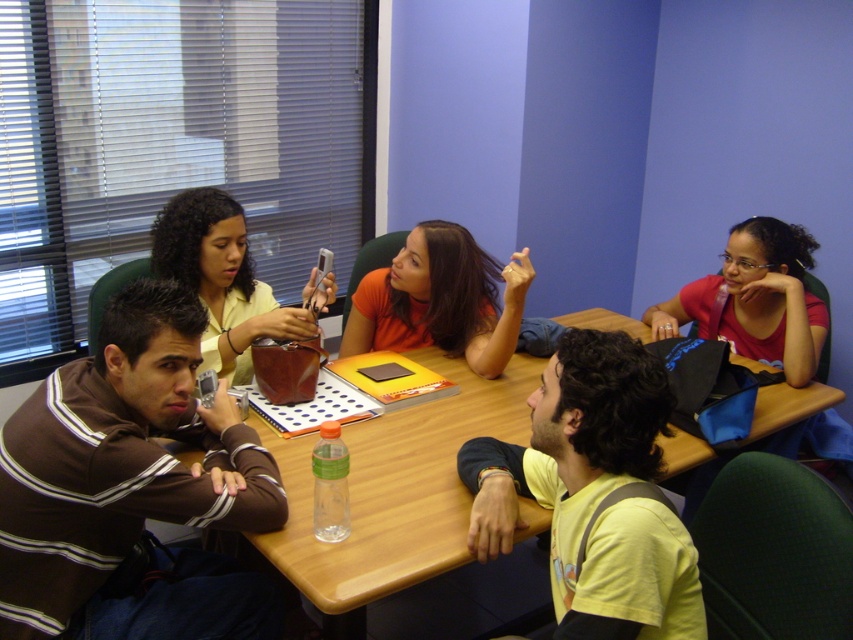
Question: Does wooden table at center appear under matte yellow shirt at center?

Choices:
 (A) no
 (B) yes

Answer: (B)

Question: Which point is farther to the camera?

Choices:
 (A) matte red shirt at upper right
 (B) matte yellow shirt at center

Answer: (A)

Question: Estimate the real-world distances between objects in this image. Which object is farther from the orange fabric shirt at center?

Choices:
 (A) matte yellow shirt at center
 (B) matte red shirt at upper right
 (C) yellow matte shirt at center

Answer: (C)

Question: Considering the real-world distances, which object is farthest from the matte yellow shirt at center?

Choices:
 (A) matte red shirt at upper right
 (B) wooden table at center
 (C) yellow matte shirt at center

Answer: (A)

Question: Observing the image, what is the correct spatial positioning of yellow matte shirt at center in reference to orange fabric shirt at center?

Choices:
 (A) right
 (B) left

Answer: (A)

Question: Is the position of wooden table at center less distant than that of orange fabric shirt at center?

Choices:
 (A) yes
 (B) no

Answer: (A)